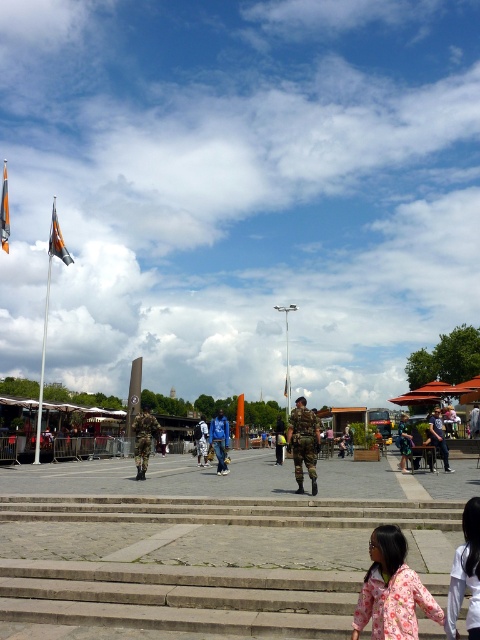
Question: Which point is closer to the camera?

Choices:
 (A) (166, 504)
 (B) (216, 451)

Answer: (A)

Question: Considering the real-world distances, which object is closest to the pink floral dress at lower right?

Choices:
 (A) concrete steps at center
 (B) white cotton shirt at center

Answer: (A)

Question: Is concrete steps at center above camouflage fabric soldier at center?

Choices:
 (A) yes
 (B) no

Answer: (A)

Question: Among these points, which one is farthest from the camera?

Choices:
 (A) (197, 508)
 (B) (382, 605)

Answer: (A)

Question: Is concrete steps at center below camouflage uniform at center?

Choices:
 (A) no
 (B) yes

Answer: (B)

Question: Observing the image, what is the correct spatial positioning of camouflage fabric soldier at center in reference to blue cotton shirt at center?

Choices:
 (A) below
 (B) above

Answer: (A)